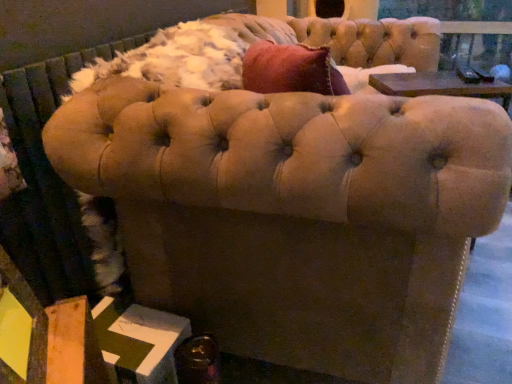
Question: Is shiny metallic bottle at lower left oriented towards velvet beige sofa at center?

Choices:
 (A) yes
 (B) no

Answer: (A)

Question: Does shiny metallic bottle at lower left have a greater height compared to velvet beige sofa at center?

Choices:
 (A) no
 (B) yes

Answer: (A)

Question: From the image's perspective, is shiny metallic bottle at lower left above velvet beige sofa at center?

Choices:
 (A) yes
 (B) no

Answer: (B)

Question: Is shiny metallic bottle at lower left at the right side of velvet beige sofa at center?

Choices:
 (A) yes
 (B) no

Answer: (B)

Question: From a real-world perspective, is shiny metallic bottle at lower left on velvet beige sofa at center?

Choices:
 (A) yes
 (B) no

Answer: (B)

Question: Considering the relative sizes of shiny metallic bottle at lower left and velvet beige sofa at center in the image provided, is shiny metallic bottle at lower left bigger than velvet beige sofa at center?

Choices:
 (A) yes
 (B) no

Answer: (B)

Question: Is the depth of velvet beige sofa at center less than that of shiny metallic bottle at lower left?

Choices:
 (A) no
 (B) yes

Answer: (B)

Question: Can you confirm if velvet beige sofa at center is wider than shiny metallic bottle at lower left?

Choices:
 (A) yes
 (B) no

Answer: (A)

Question: From a real-world perspective, is velvet beige sofa at center under shiny metallic bottle at lower left?

Choices:
 (A) no
 (B) yes

Answer: (A)

Question: Is velvet beige sofa at center positioned beyond the bounds of shiny metallic bottle at lower left?

Choices:
 (A) yes
 (B) no

Answer: (A)

Question: Can you confirm if velvet beige sofa at center is positioned to the right of shiny metallic bottle at lower left?

Choices:
 (A) no
 (B) yes

Answer: (B)

Question: Is the depth of velvet beige sofa at center greater than that of shiny metallic bottle at lower left?

Choices:
 (A) yes
 (B) no

Answer: (B)

Question: From a real-world perspective, is shiny metallic bottle at lower left positioned above or below velvet beige sofa at center?

Choices:
 (A) above
 (B) below

Answer: (B)